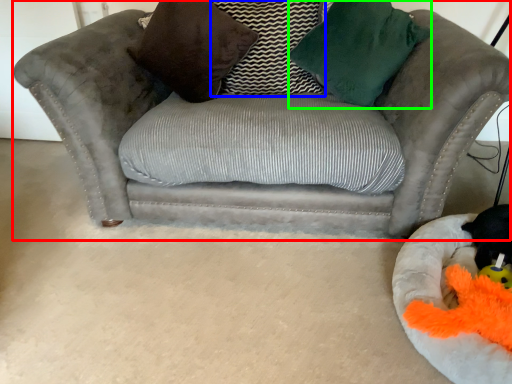
Question: Which object is the farthest from studio couch (highlighted by a red box)? Choose among these: pillow (highlighted by a blue box) or throw pillow (highlighted by a green box).

Choices:
 (A) pillow
 (B) throw pillow

Answer: (A)